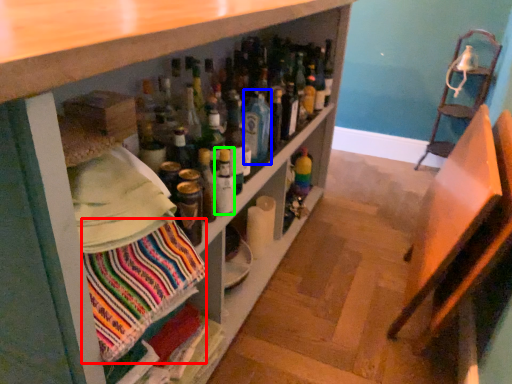
Question: Estimate the real-world distances between objects in this image. Which object is closer to fabric (highlighted by a red box), beverage (highlighted by a blue box) or bottle (highlighted by a green box)?

Choices:
 (A) beverage
 (B) bottle

Answer: (B)